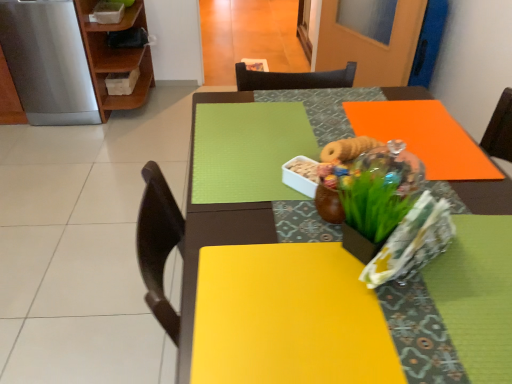
I want to click on vacant space in front of stainless steel refrigerator at left, so tap(53, 148).